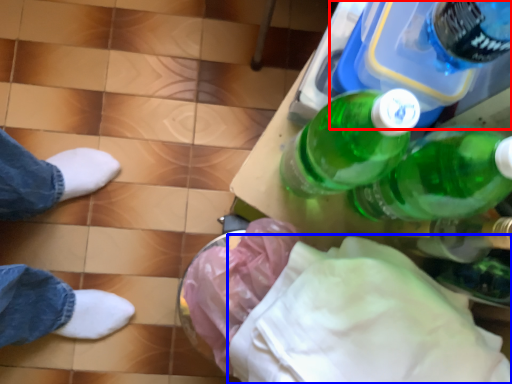
Question: Which point is further to the camera, bottle (highlighted by a red box) or cloth (highlighted by a blue box)?

Choices:
 (A) bottle
 (B) cloth

Answer: (A)